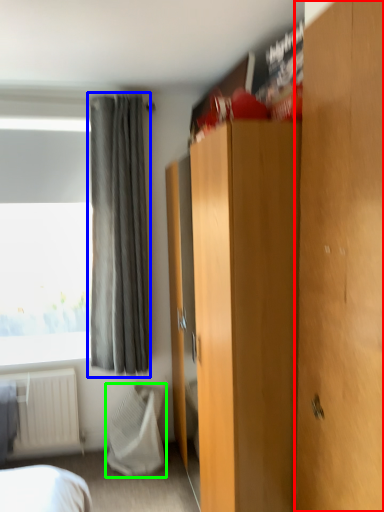
Question: Which is nearer to the door (highlighted by a red box)? curtain (highlighted by a blue box) or blanket (highlighted by a green box).

Choices:
 (A) curtain
 (B) blanket

Answer: (A)